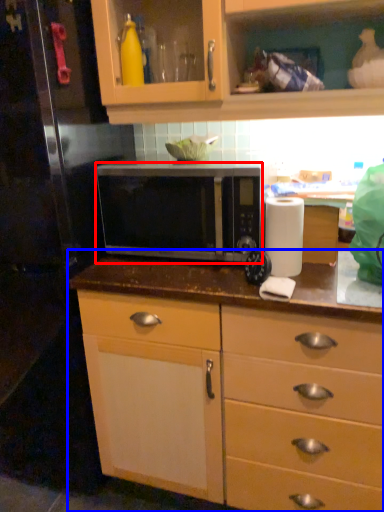
Question: Which of the following is the farthest to the observer, microwave oven (highlighted by a red box) or countertop (highlighted by a blue box)?

Choices:
 (A) microwave oven
 (B) countertop

Answer: (A)